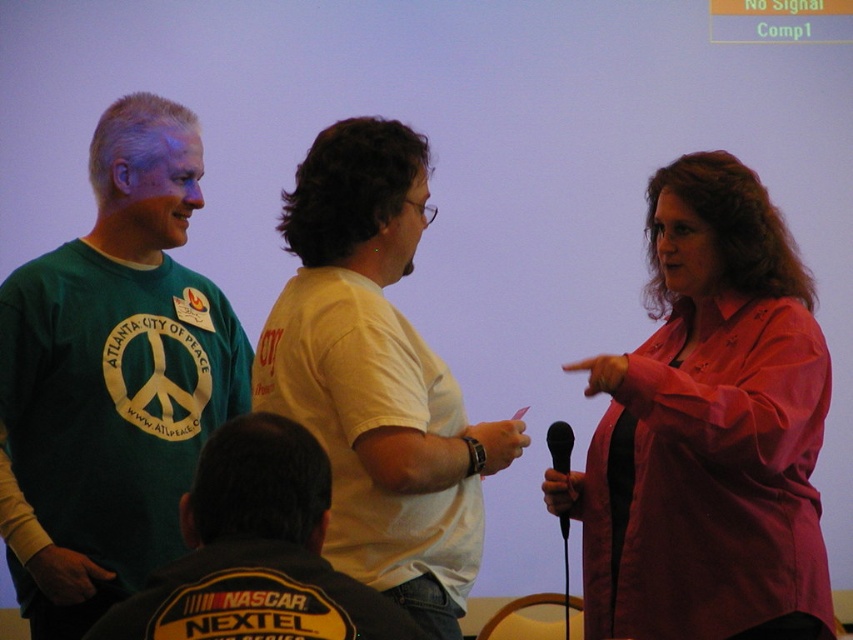
Does green matte t-shirt at left appear on the left side of dark gray fabric shirt at center?

Indeed, green matte t-shirt at left is positioned on the left side of dark gray fabric shirt at center.

Measure the distance between green matte t-shirt at left and dark gray fabric shirt at center.

The distance of green matte t-shirt at left from dark gray fabric shirt at center is 3.58 feet.

Is point (170, 435) in front of point (305, 627)?

No, it is not.

The image size is (853, 640). I want to click on green matte t-shirt at left, so click(111, 378).

Which of these two, green matte t-shirt at left or white matte t-shirt at center, stands taller?

green matte t-shirt at left is taller.

Is point (233, 416) farther from viewer compared to point (344, 461)?

That is True.

Identify the location of green matte t-shirt at left. (111, 378).

Does pink satin blouse at right appear on the right side of green matte t-shirt at left?

Indeed, pink satin blouse at right is positioned on the right side of green matte t-shirt at left.

Between point (761, 257) and point (140, 412), which one is positioned behind?

Point (140, 412)

Where is `pink satin blouse at right`? This screenshot has height=640, width=853. pink satin blouse at right is located at coordinates (708, 429).